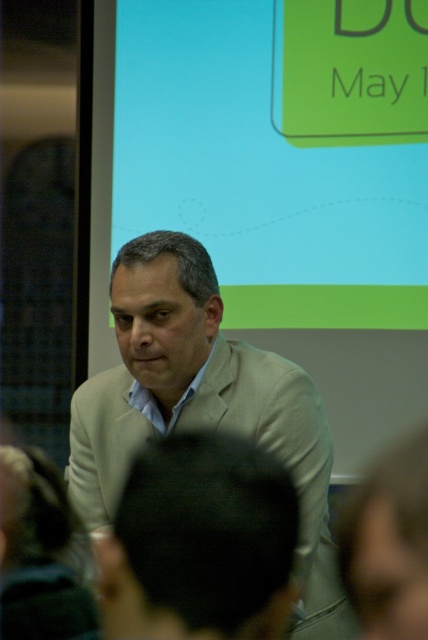
Question: Can you confirm if matte green projection screen at upper center is positioned above beige sweater at center?

Choices:
 (A) yes
 (B) no

Answer: (A)

Question: Which of the following is the farthest from the observer?

Choices:
 (A) beige fabric suit at center
 (B) matte green projection screen at upper center

Answer: (B)

Question: Among these objects, which one is nearest to the camera?

Choices:
 (A) beige sweater at center
 (B) beige fabric suit at center
 (C) matte green projection screen at upper center

Answer: (B)

Question: Estimate the real-world distances between objects in this image. Which object is closer to the matte green projection screen at upper center?

Choices:
 (A) beige sweater at center
 (B) beige fabric suit at center

Answer: (A)

Question: Is beige sweater at center to the left of beige fabric suit at center from the viewer's perspective?

Choices:
 (A) no
 (B) yes

Answer: (B)

Question: Can you confirm if matte green projection screen at upper center is positioned to the right of beige fabric suit at center?

Choices:
 (A) no
 (B) yes

Answer: (B)